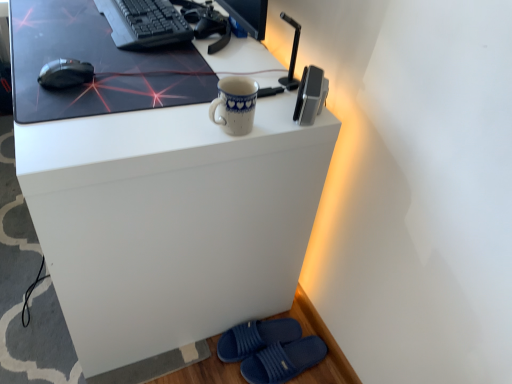
The height and width of the screenshot is (384, 512). I want to click on free location to the right of black matte mouse at left, so click(x=139, y=88).